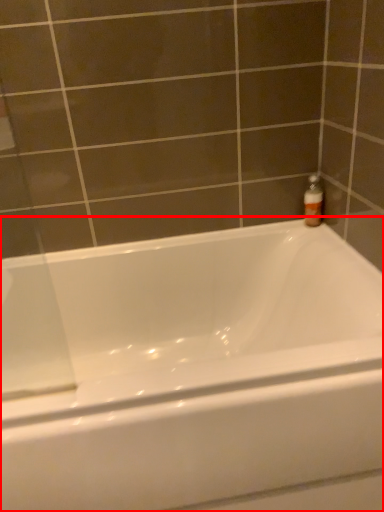
Question: From the image's perspective, where is bathtub (annotated by the red box) located relative to bottle?

Choices:
 (A) above
 (B) below

Answer: (B)